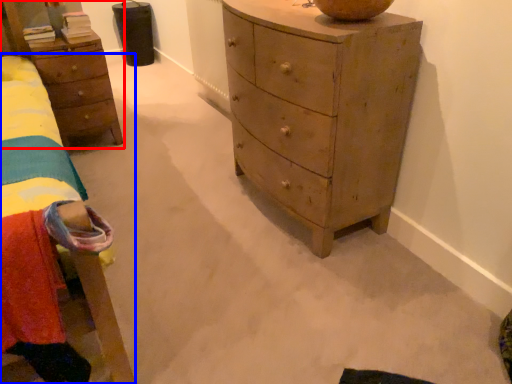
Question: Which object appears closest to the camera in this image, nightstand (highlighted by a red box) or bed (highlighted by a blue box)?

Choices:
 (A) nightstand
 (B) bed

Answer: (B)